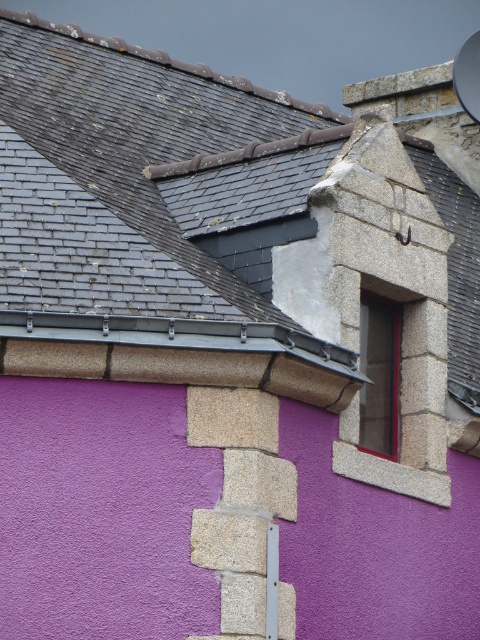
Question: Among these points, which one is nearest to the camera?

Choices:
 (A) [x=147, y=305]
 (B) [x=384, y=412]

Answer: (A)

Question: In this image, where is gray slate roof at upper left located relative to smooth stone window at upper right?

Choices:
 (A) below
 (B) above

Answer: (B)

Question: Can you confirm if gray slate roof at upper left is positioned to the right of smooth stone window at upper right?

Choices:
 (A) no
 (B) yes

Answer: (A)

Question: Which object appears closest to the camera in this image?

Choices:
 (A) gray slate roof at upper left
 (B) smooth stone window at upper right

Answer: (A)

Question: Does gray slate roof at upper left have a lesser width compared to smooth stone window at upper right?

Choices:
 (A) yes
 (B) no

Answer: (B)